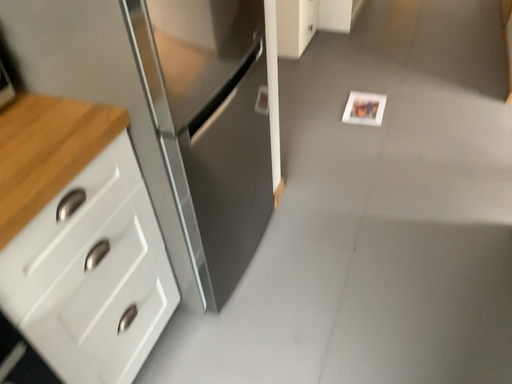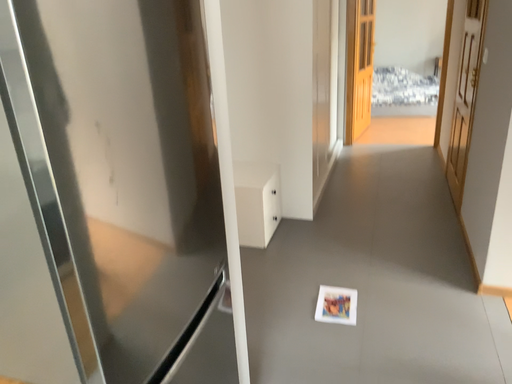
Question: Which way did the camera rotate in the video?

Choices:
 (A) rotated upward
 (B) rotated downward

Answer: (A)